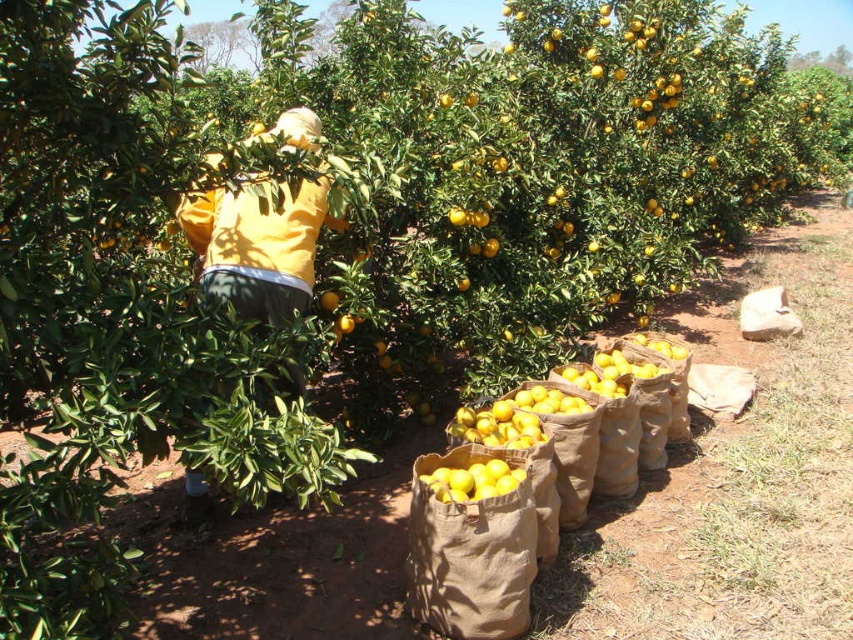
Question: Is yellow matte jacket at center positioned in front of yellow matte bag at center?

Choices:
 (A) no
 (B) yes

Answer: (A)

Question: Which point is closer to the camera?

Choices:
 (A) (459, 468)
 (B) (287, 209)

Answer: (A)

Question: Does yellow matte jacket at center have a lesser width compared to yellow matte bag at center?

Choices:
 (A) yes
 (B) no

Answer: (B)

Question: Considering the relative positions of yellow matte jacket at center and yellow matte bag at center in the image provided, where is yellow matte jacket at center located with respect to yellow matte bag at center?

Choices:
 (A) right
 (B) left

Answer: (B)